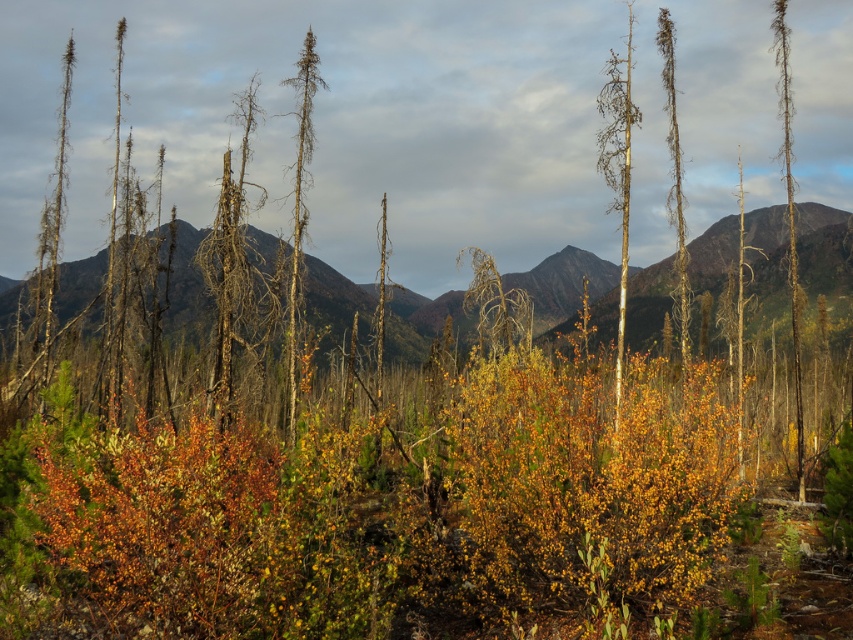
You are a hiker who wants to take a photo of both the smooth silver tree at center and the brown bark tree at right. You need to position yourself so that both trees are fully visible in the frame. Considering their heights, which tree should you stand closer to in order to include both in your photo?

The smooth silver tree at center is taller than the brown bark tree at right. To include both in the frame, you should stand closer to the taller smooth silver tree at center so that the shorter brown bark tree at right doesn

You are a hiker who wants to take a photo of both the smooth silver tree at center and the brown bark tree at right. You are standing at the left edge of the scene. Which direction should you walk to frame both trees in your camera without moving your camera position?

You should walk to the right so that both the smooth silver tree at center and the brown bark tree at right come into view. Since the smooth silver tree at center is to the left of the brown bark tree at right, moving rightward will allow you to capture both in your camera frame from your current position at the left edge.